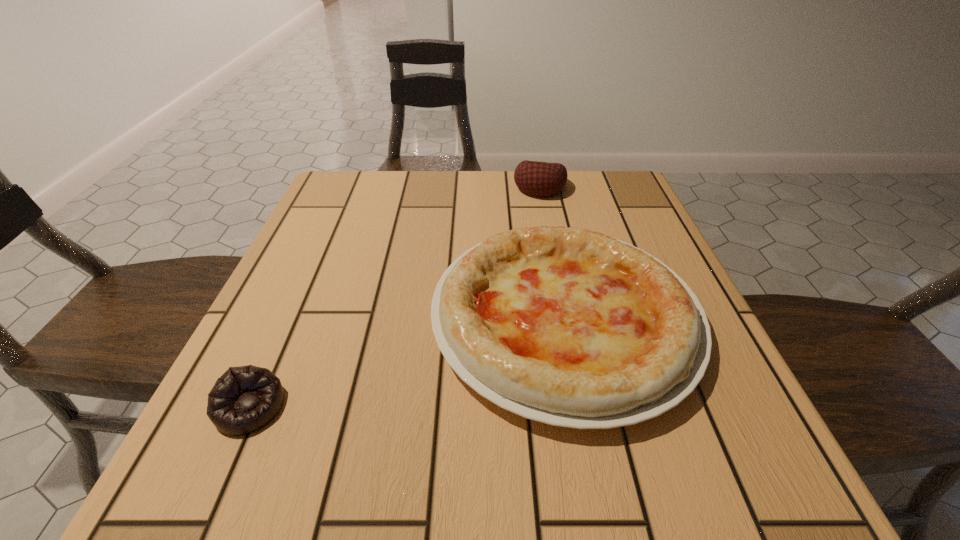
Where is `free spot between the shorter beanbag and the taller beanbag`? This screenshot has height=540, width=960. free spot between the shorter beanbag and the taller beanbag is located at coordinates (395, 297).

You are a GUI agent. You are given a task and a screenshot of the screen. Output one action in this format:
    pyautogui.click(x=<x>, y=<y>)
    Task: Click on the free space between the right beanbag and the leftmost object
    The height and width of the screenshot is (540, 960).
    Given the screenshot: What is the action you would take?
    pyautogui.click(x=395, y=297)

Where is `vacant region between the pizza and the nearer beanbag`? The width and height of the screenshot is (960, 540). vacant region between the pizza and the nearer beanbag is located at coordinates (407, 362).

Image resolution: width=960 pixels, height=540 pixels. What are the coordinates of `free space between the pizza and the leftmost object` in the screenshot? It's located at (407, 362).

Identify the location of free space between the leftmost object and the pizza. (407, 362).

Locate which object is the second closest to the right beanbag. Please provide its 2D coordinates. Your answer should be formatted as a tuple, i.e. [(x, y)], where the tuple contains the x and y coordinates of a point satisfying the conditions above.

[(244, 399)]

Point out which object is positioned as the second nearest to the farthest object. Please provide its 2D coordinates. Your answer should be formatted as a tuple, i.e. [(x, y)], where the tuple contains the x and y coordinates of a point satisfying the conditions above.

[(244, 399)]

Where is `blank space that satisfies the following two spatial constraints: 1. on the back side of the pizza; 2. on the left side of the taller beanbag`? blank space that satisfies the following two spatial constraints: 1. on the back side of the pizza; 2. on the left side of the taller beanbag is located at coordinates (539, 187).